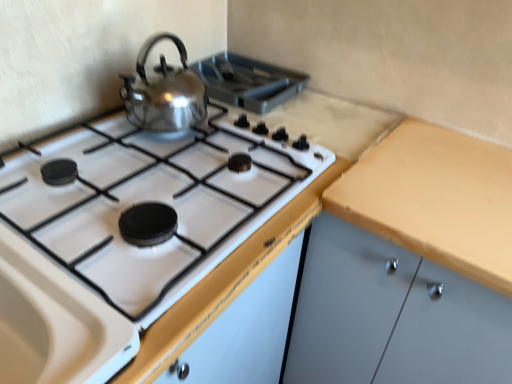
Where is `free location above matte wood cabinet at right (from a real-world perspective)`? free location above matte wood cabinet at right (from a real-world perspective) is located at coordinates (450, 170).